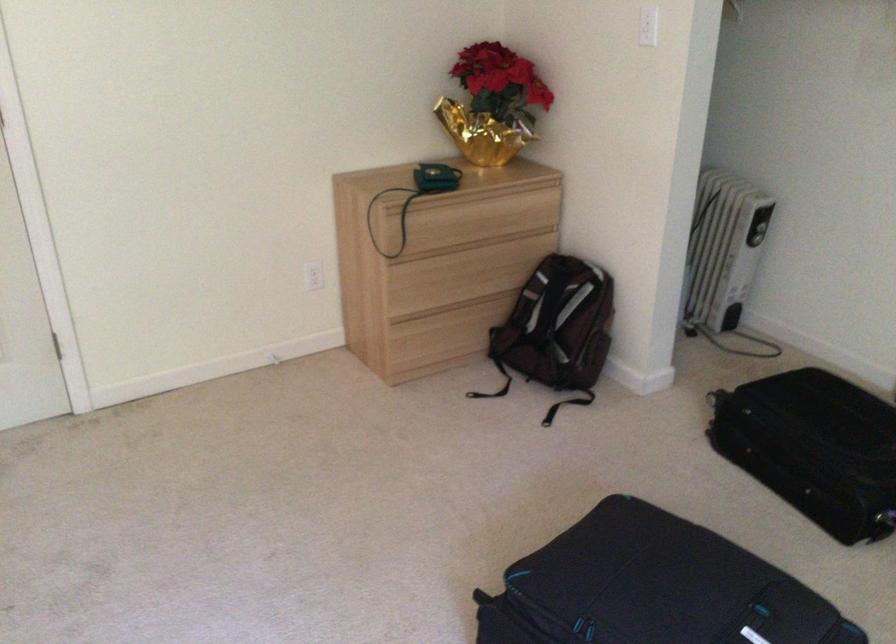
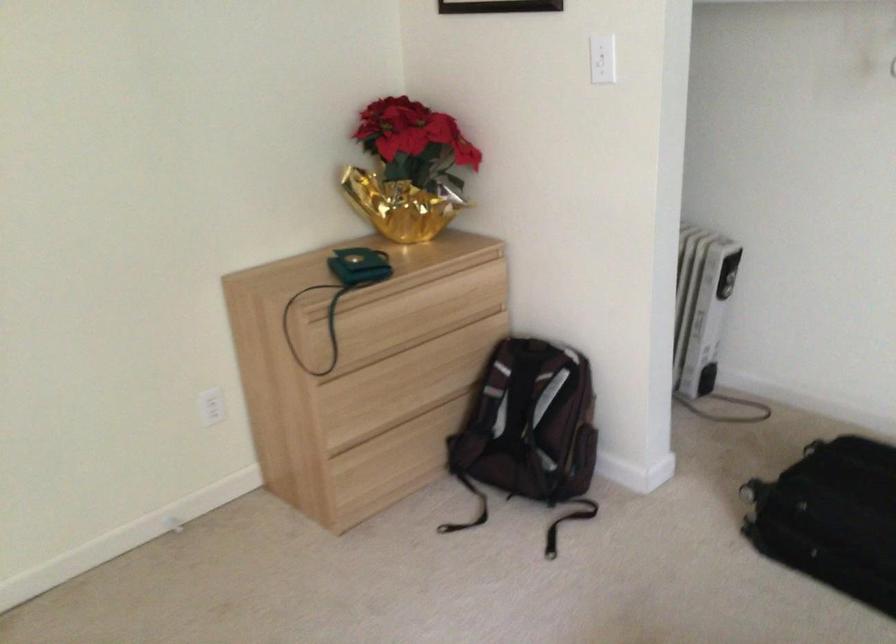
Where in the second image is the point corresponding to pixel 432 348 from the first image?

(382, 478)